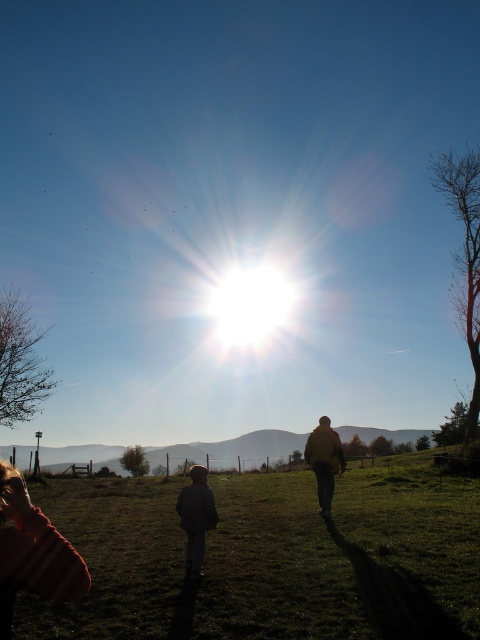
Question: Is green grass at lower center to the left of brown leather jacket at center from the viewer's perspective?

Choices:
 (A) yes
 (B) no

Answer: (A)

Question: Which point is farther to the camera?

Choices:
 (A) green grass at lower center
 (B) dark gray jacket at center
 (C) brown leather jacket at center

Answer: (C)

Question: Which point appears farthest from the camera in this image?

Choices:
 (A) (189, 515)
 (B) (338, 460)
 (C) (154, 586)

Answer: (B)

Question: Which point is farther to the camera?

Choices:
 (A) brown leather jacket at center
 (B) green grass at lower center

Answer: (A)

Question: Is dark gray jacket at center wider than brown leather jacket at center?

Choices:
 (A) no
 (B) yes

Answer: (B)

Question: Does green grass at lower center appear on the right side of dark gray jacket at center?

Choices:
 (A) yes
 (B) no

Answer: (A)